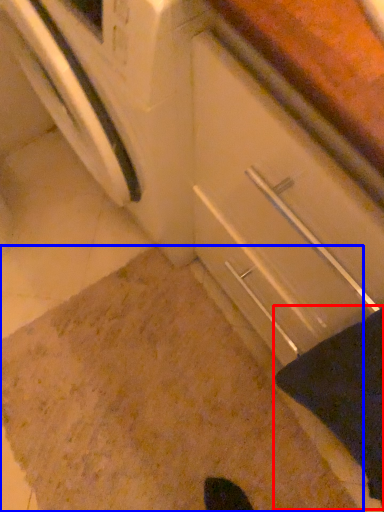
Question: Which of the following is the closest to the observer, blanket (highlighted by a red box) or granite (highlighted by a blue box)?

Choices:
 (A) blanket
 (B) granite

Answer: (A)